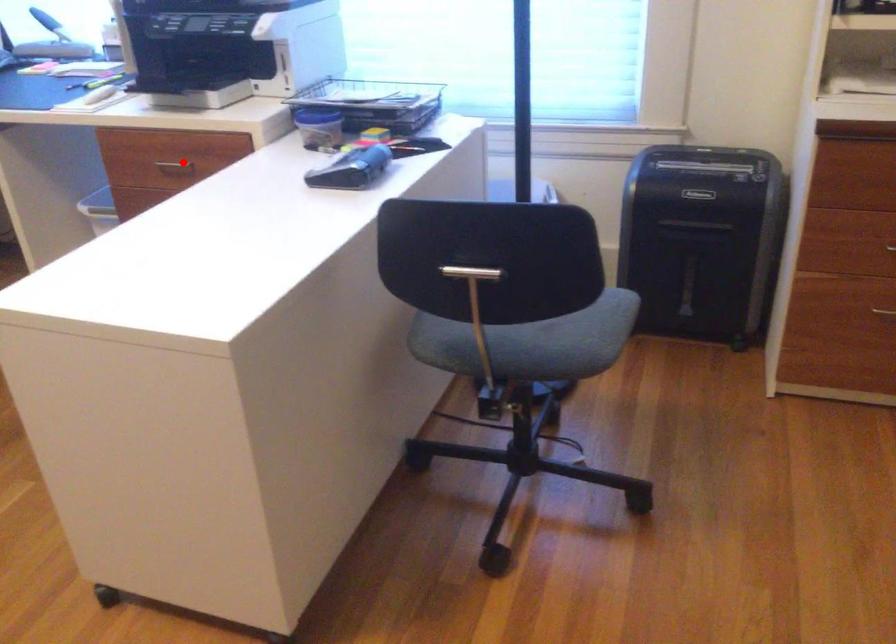
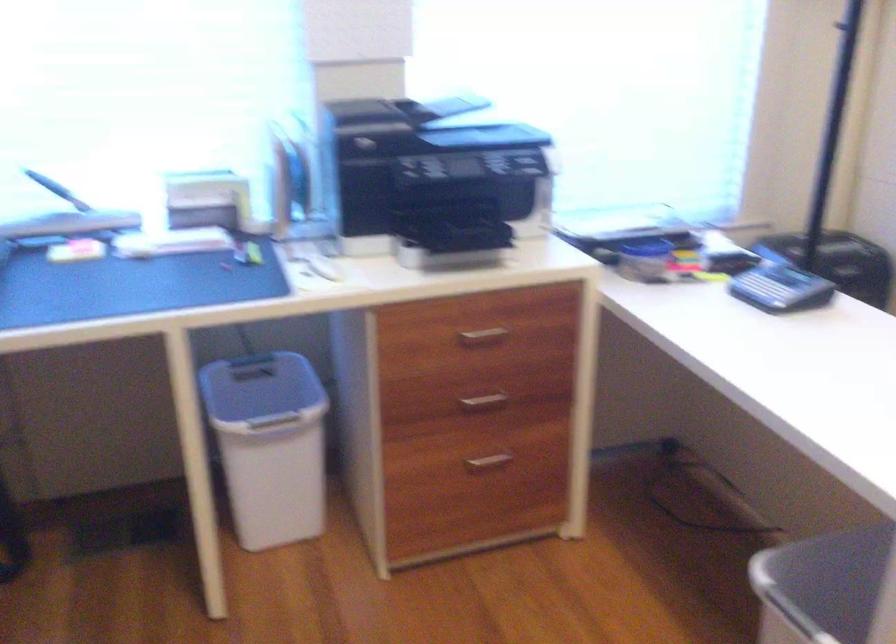
Find the pixel in the second image that matches the highlighted location in the first image.

(483, 334)